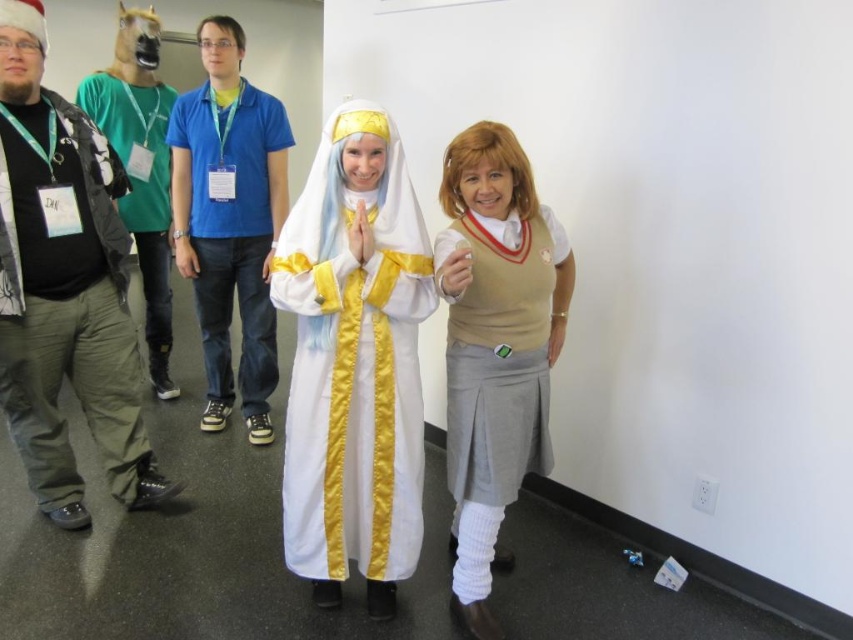
Question: Can you confirm if black matte jacket at left is positioned to the left of beige knit sweater at center?

Choices:
 (A) yes
 (B) no

Answer: (A)

Question: Which object is the closest to the beige knit sweater at center?

Choices:
 (A) black matte jacket at left
 (B) blue cotton shirt at center
 (C) white satin robe at center

Answer: (C)

Question: In this image, where is white satin robe at center located relative to beige knit sweater at center?

Choices:
 (A) right
 (B) left

Answer: (B)

Question: Which object appears closest to the camera in this image?

Choices:
 (A) beige knit sweater at center
 (B) black matte jacket at left
 (C) blue cotton shirt at center

Answer: (A)

Question: Among these points, which one is farthest from the camera?

Choices:
 (A) (16, 276)
 (B) (479, 264)
 (C) (335, 157)

Answer: (A)

Question: Does black matte jacket at left have a smaller size compared to blue cotton shirt at center?

Choices:
 (A) yes
 (B) no

Answer: (A)